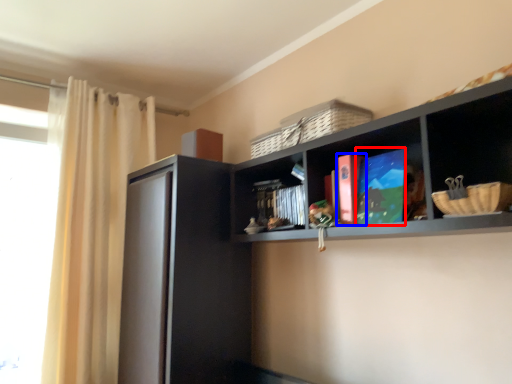
Question: Which object is closer to the camera taking this photo, book (highlighted by a red box) or book (highlighted by a blue box)?

Choices:
 (A) book
 (B) book

Answer: (A)